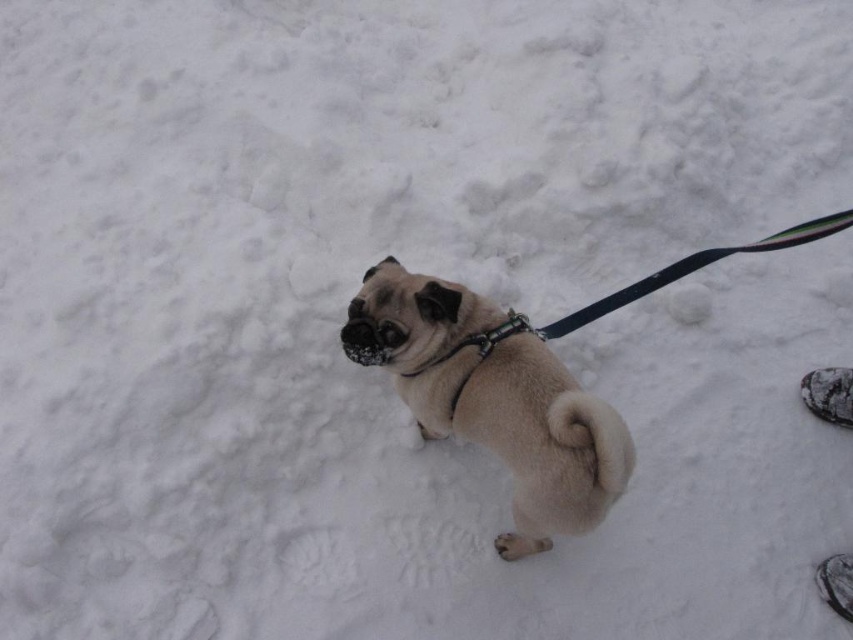
Question: Which object appears farthest from the camera in this image?

Choices:
 (A) metallic chain at center
 (B) fuzzy beige dog at center

Answer: (A)

Question: In this image, where is fuzzy beige dog at center located relative to metallic chain at center?

Choices:
 (A) above
 (B) below

Answer: (B)

Question: From the image, what is the correct spatial relationship of fuzzy beige dog at center in relation to metallic chain at center?

Choices:
 (A) left
 (B) right

Answer: (B)

Question: Which of the following is the farthest from the observer?

Choices:
 (A) (544, 358)
 (B) (430, 368)

Answer: (B)

Question: Among these objects, which one is farthest from the camera?

Choices:
 (A) fuzzy beige dog at center
 (B) metallic chain at center

Answer: (B)

Question: Does fuzzy beige dog at center have a greater width compared to metallic chain at center?

Choices:
 (A) no
 (B) yes

Answer: (B)